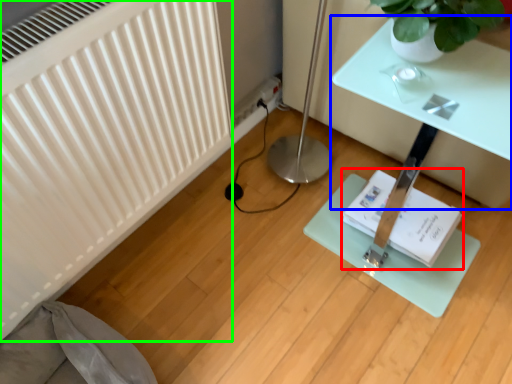
Question: Based on their relative distances, which object is nearer to book (highlighted by a red box)? Choose from table (highlighted by a blue box) and radiator (highlighted by a green box).

Choices:
 (A) table
 (B) radiator

Answer: (A)